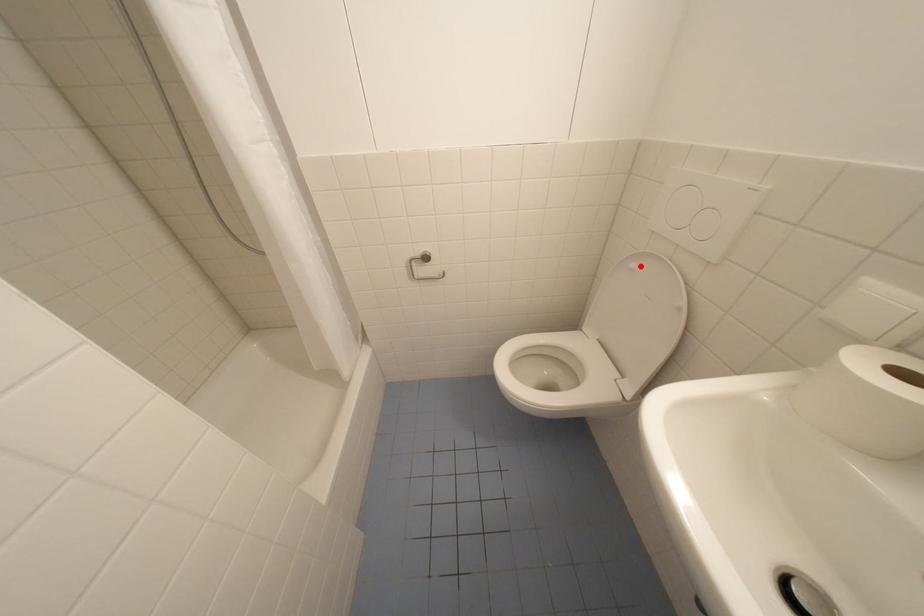
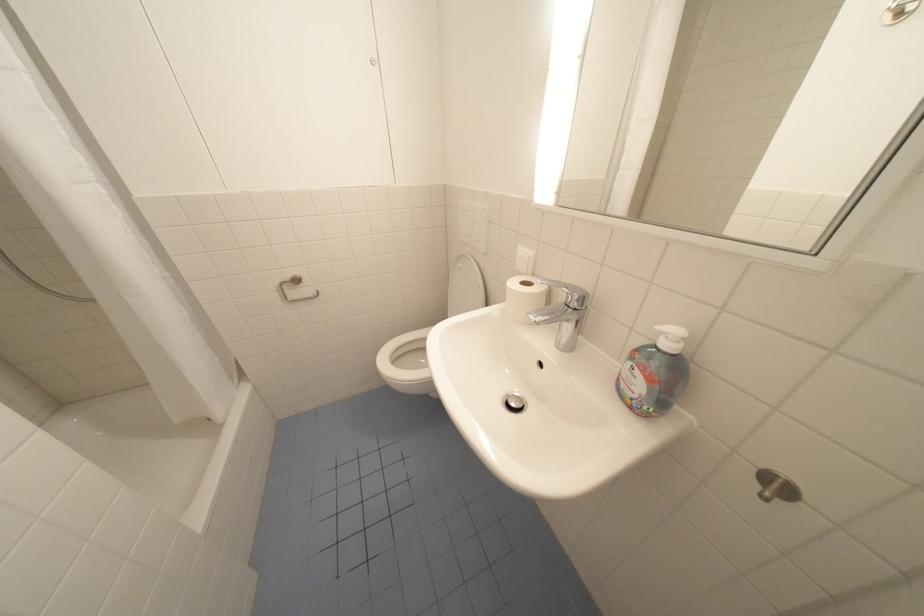
Locate, in the second image, the point that corresponds to the highlighted location in the first image.

(468, 265)